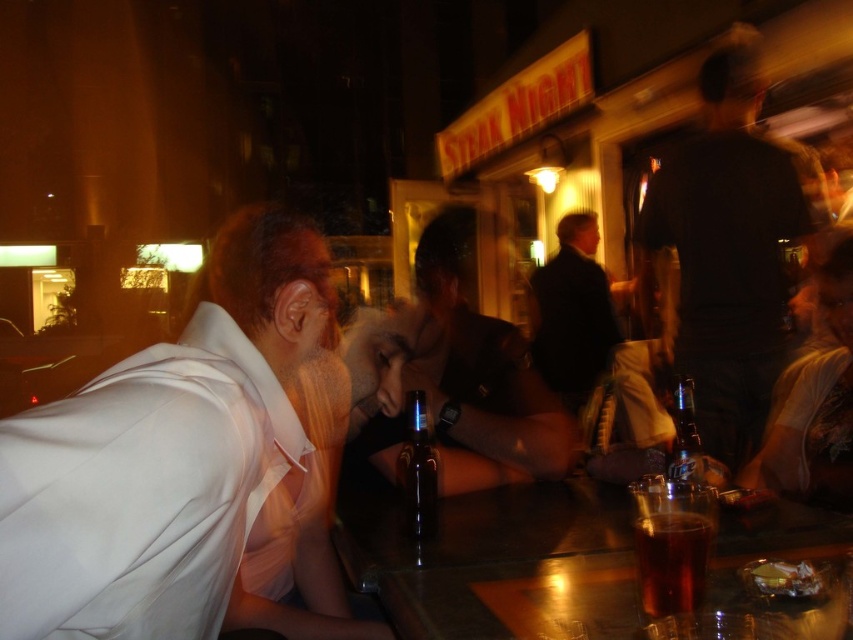
Is shiny brown wood table at center to the left of black glass bottle at center from the viewer's perspective?

Incorrect, shiny brown wood table at center is not on the left side of black glass bottle at center.

Does shiny brown wood table at center have a lesser height compared to black glass bottle at center?

Indeed, shiny brown wood table at center has a lesser height compared to black glass bottle at center.

At what (x,y) coordinates should I click in order to perform the action: click on shiny brown wood table at center. Please return your answer as a coordinate pair (x, y). Image resolution: width=853 pixels, height=640 pixels. Looking at the image, I should click on (485, 554).

Does point (421, 572) come closer to viewer compared to point (697, 444)?

That is True.

Who is more distant from viewer, (804, 541) or (671, 451)?

The point (671, 451) is more distant.

I want to click on shiny brown wood table at center, so click(x=485, y=554).

Who is higher up, dark brown leather jacket at center or clear glass bottle at center?

dark brown leather jacket at center is above.

Does point (599, 468) come closer to viewer compared to point (682, 442)?

No, (599, 468) is further to viewer.

The width and height of the screenshot is (853, 640). What are the coordinates of `dark brown leather jacket at center` in the screenshot? It's located at (593, 353).